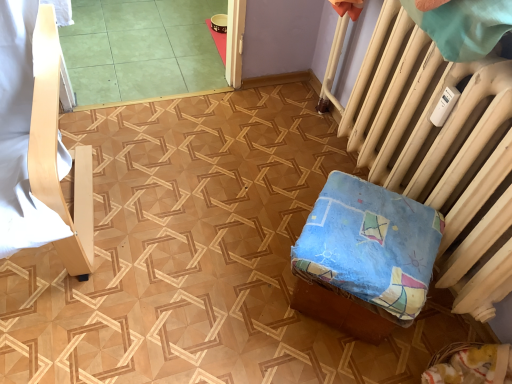
Identify the location of vacant space behind light wood chair at left, the first furniture viewed from the left. This screenshot has height=384, width=512. (154, 124).